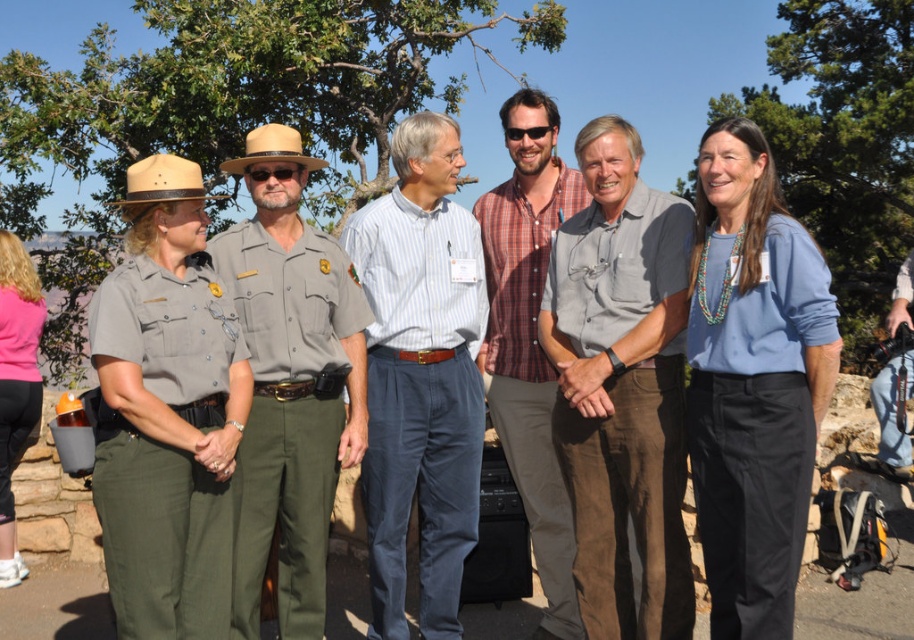
Is gray cotton shirt at center bigger than matte khaki uniform at left?

Yes, gray cotton shirt at center is bigger than matte khaki uniform at left.

Is point (663, 356) less distant than point (200, 625)?

No, (663, 356) is further to viewer.

Identify the location of gray cotton shirt at center. The image size is (914, 640). (622, 388).

Is the position of blue cotton shirt at center less distant than that of light blue striped shirt at center?

Yes, blue cotton shirt at center is closer to the viewer.

Which is more to the left, blue cotton shirt at center or light blue striped shirt at center?

light blue striped shirt at center is more to the left.

In the scene shown: Who is more distant from viewer, (756, 198) or (442, 336)?

The point (442, 336) is more distant.

Image resolution: width=914 pixels, height=640 pixels. What are the coordinates of `blue cotton shirt at center` in the screenshot? It's located at (753, 381).

Which is in front, point (179, 593) or point (768, 392)?

Point (179, 593) is in front.

Is point (204, 317) less distant than point (721, 570)?

Yes, it is.

This screenshot has width=914, height=640. I want to click on matte khaki uniform at left, so click(x=166, y=412).